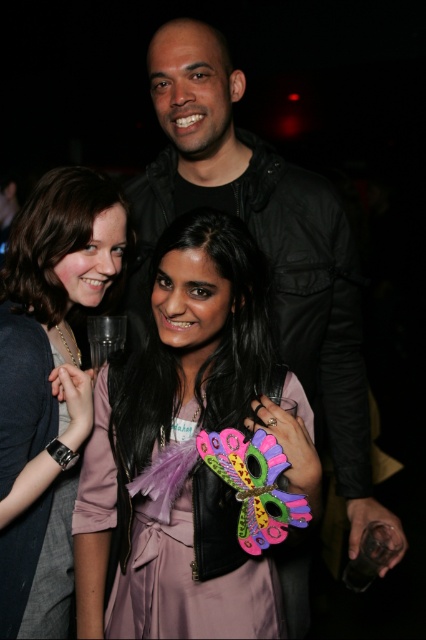
Is matte pink dress at center shorter than black leather jacket at upper center?

Correct, matte pink dress at center is not as tall as black leather jacket at upper center.

Can you confirm if matte pink dress at center is positioned below black leather jacket at upper center?

Indeed, matte pink dress at center is positioned under black leather jacket at upper center.

Who is more distant from viewer, (193, 634) or (227, 74)?

The point (227, 74) is behind.

Image resolution: width=426 pixels, height=640 pixels. I want to click on matte pink dress at center, so click(192, 452).

Who is more distant from viewer, (31, 376) or (11, 316)?

The point (11, 316) is behind.

Can you confirm if matte black dress at center is positioned above pink satin dress at center?

Yes.

Is point (25, 436) farther from viewer compared to point (60, 609)?

No, it is not.

This screenshot has width=426, height=640. In order to click on matte black dress at center in this screenshot , I will do `click(48, 385)`.

Can you confirm if black leather jacket at upper center is positioned above pink satin dress at center?

Yes, black leather jacket at upper center is above pink satin dress at center.

Can you confirm if black leather jacket at upper center is shorter than pink satin dress at center?

No.

Does point (236, 186) come behind point (69, 493)?

Yes, point (236, 186) is behind point (69, 493).

This screenshot has width=426, height=640. Find the location of `black leather jacket at upper center`. black leather jacket at upper center is located at coordinates (261, 243).